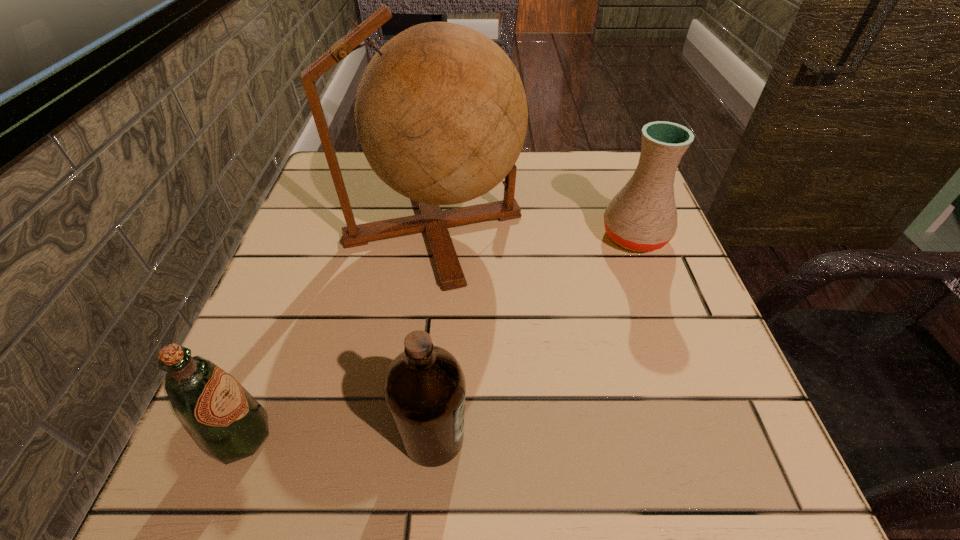
Image resolution: width=960 pixels, height=540 pixels. I want to click on empty space between the left olive oil and the globe, so click(x=337, y=332).

Point out which object is positioned as the second nearest to the left olive oil. Please provide its 2D coordinates. Your answer should be formatted as a tuple, i.e. [(x, y)], where the tuple contains the x and y coordinates of a point satisfying the conditions above.

[(441, 114)]

Identify which object is located as the third nearest to the left olive oil. Please provide its 2D coordinates. Your answer should be formatted as a tuple, i.e. [(x, y)], where the tuple contains the x and y coordinates of a point satisfying the conditions above.

[(642, 216)]

Locate an element on the screen. vacant space that satisfies the following two spatial constraints: 1. on the surface of the globe; 2. on the left side of the rightmost object is located at coordinates (433, 236).

This screenshot has width=960, height=540. I want to click on vacant region that satisfies the following two spatial constraints: 1. on the surface of the tallest object; 2. on the back side of the rightmost object, so click(x=433, y=236).